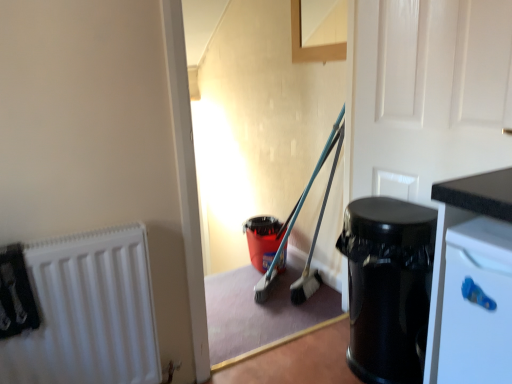
Question: Considering the relative sizes of white glossy door at upper right and white matte radiator at left in the image provided, is white glossy door at upper right smaller than white matte radiator at left?

Choices:
 (A) yes
 (B) no

Answer: (B)

Question: Is white glossy door at upper right wider than white matte radiator at left?

Choices:
 (A) yes
 (B) no

Answer: (B)

Question: Is the depth of white glossy door at upper right less than that of white matte radiator at left?

Choices:
 (A) yes
 (B) no

Answer: (A)

Question: Can you confirm if white glossy door at upper right is shorter than white matte radiator at left?

Choices:
 (A) no
 (B) yes

Answer: (A)

Question: From the image's perspective, is white glossy door at upper right above white matte radiator at left?

Choices:
 (A) yes
 (B) no

Answer: (A)

Question: Would you say white glossy door at upper right contains white matte radiator at left?

Choices:
 (A) no
 (B) yes

Answer: (A)

Question: Is white matte radiator at left directly adjacent to white glossy door at upper right?

Choices:
 (A) yes
 (B) no

Answer: (B)

Question: Does white matte radiator at left have a lesser width compared to white glossy door at upper right?

Choices:
 (A) no
 (B) yes

Answer: (A)

Question: From the image's perspective, is white matte radiator at left above white glossy door at upper right?

Choices:
 (A) yes
 (B) no

Answer: (B)

Question: Considering the relative sizes of white matte radiator at left and white glossy door at upper right in the image provided, is white matte radiator at left taller than white glossy door at upper right?

Choices:
 (A) yes
 (B) no

Answer: (B)

Question: Is white matte radiator at left turned away from white glossy door at upper right?

Choices:
 (A) yes
 (B) no

Answer: (B)

Question: Does white matte radiator at left come in front of white glossy door at upper right?

Choices:
 (A) yes
 (B) no

Answer: (B)

Question: From a real-world perspective, is white matte radiator at left positioned under black glossy trash can at right based on gravity?

Choices:
 (A) no
 (B) yes

Answer: (A)